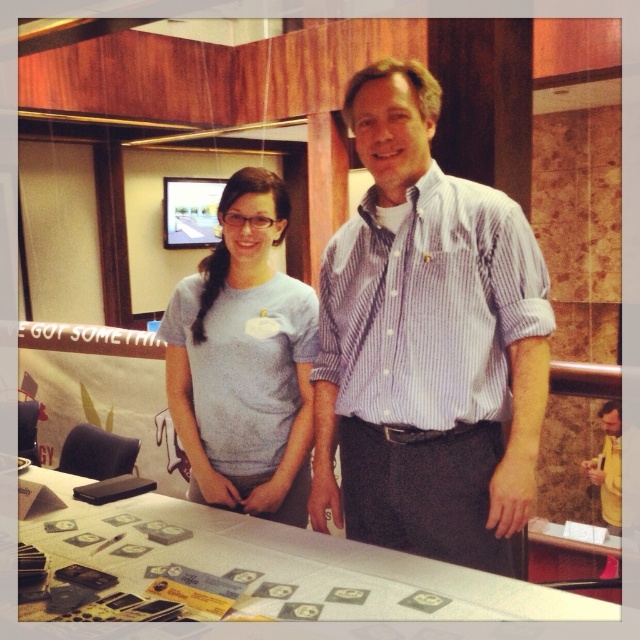
Is white paper at center below gray matte t-shirt at center?

Yes, white paper at center is below gray matte t-shirt at center.

Who is positioned more to the left, white paper at center or gray matte t-shirt at center?

From the viewer's perspective, white paper at center appears more on the left side.

At what (x,y) coordinates should I click in order to perform the action: click on white paper at center. Please return your answer as a coordinate pair (x, y). Looking at the image, I should click on (252, 570).

Locate an element on the screen. white paper at center is located at coordinates point(252,570).

Is striped cotton shirt at center bigger than gray matte t-shirt at center?

Correct, striped cotton shirt at center is larger in size than gray matte t-shirt at center.

Can you confirm if striped cotton shirt at center is taller than gray matte t-shirt at center?

Indeed, striped cotton shirt at center has a greater height compared to gray matte t-shirt at center.

Between point (483, 218) and point (292, 401), which one is positioned behind?

Point (292, 401)

This screenshot has width=640, height=640. What are the coordinates of `striped cotton shirt at center` in the screenshot? It's located at (426, 344).

This screenshot has width=640, height=640. What do you see at coordinates (426, 344) in the screenshot?
I see `striped cotton shirt at center` at bounding box center [426, 344].

Can you confirm if striped cotton shirt at center is wider than white paper at center?

In fact, striped cotton shirt at center might be narrower than white paper at center.

Locate an element on the screen. This screenshot has height=640, width=640. striped cotton shirt at center is located at coordinates (426, 344).

You are a GUI agent. You are given a task and a screenshot of the screen. Output one action in this format:
    pyautogui.click(x=<x>, y=<y>)
    Task: Click on the striped cotton shirt at center
    This screenshot has width=640, height=640.
    Given the screenshot: What is the action you would take?
    pyautogui.click(x=426, y=344)